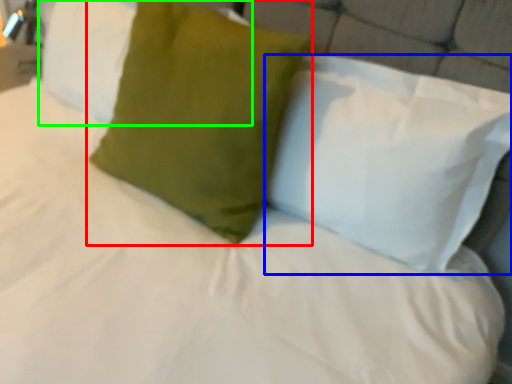
Question: Considering the real-world distances, which object is farthest from pillow (highlighted by a red box)? pillow (highlighted by a blue box) or pillow (highlighted by a green box)?

Choices:
 (A) pillow
 (B) pillow

Answer: (B)